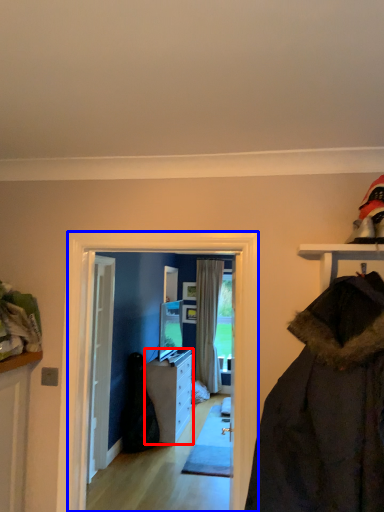
Question: Which object is closer to the camera taking this photo, cabinetry (highlighted by a red box) or screen door (highlighted by a blue box)?

Choices:
 (A) cabinetry
 (B) screen door

Answer: (B)